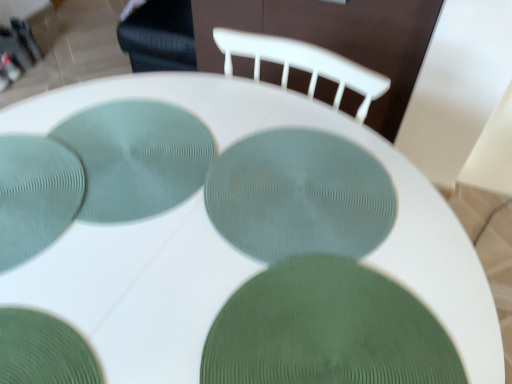
Where is `free space between green textured plate at center, the 5th glass plate positioned from the left, and teal textured placemat at center, the third glass plate viewed from the left`? free space between green textured plate at center, the 5th glass plate positioned from the left, and teal textured placemat at center, the third glass plate viewed from the left is located at coordinates (219, 237).